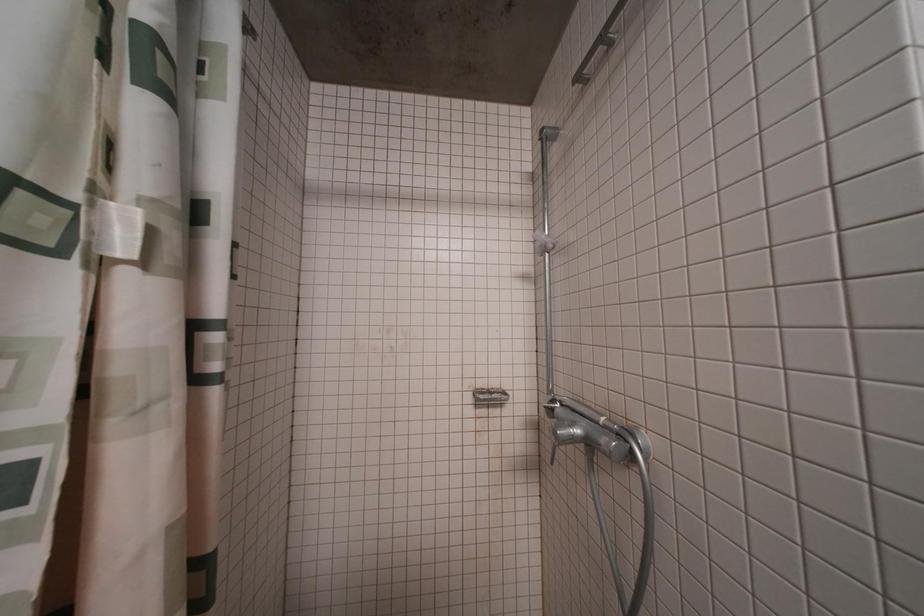
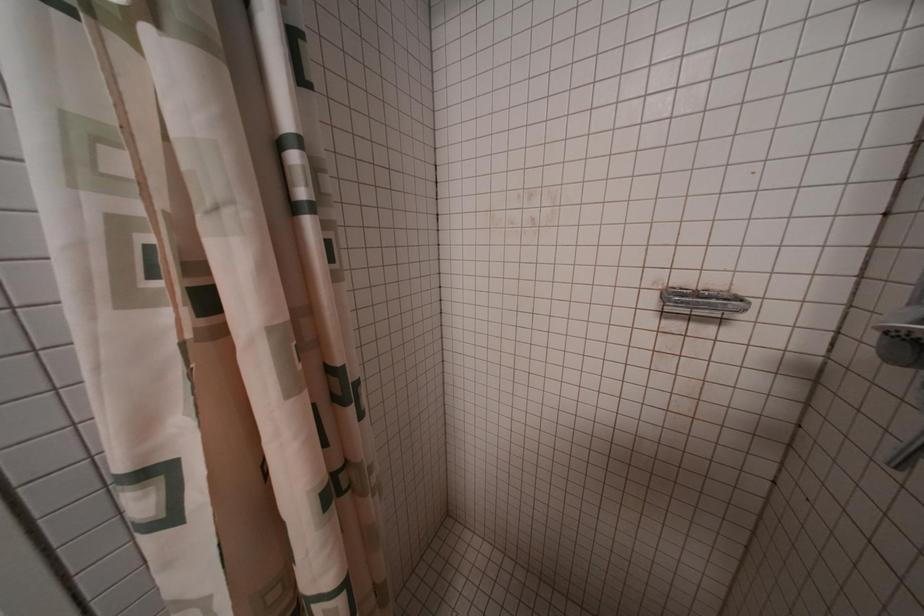
The first image is from the beginning of the video and the second image is from the end. How did the camera likely rotate when shooting the video?

The rotation direction of the camera is left-down.